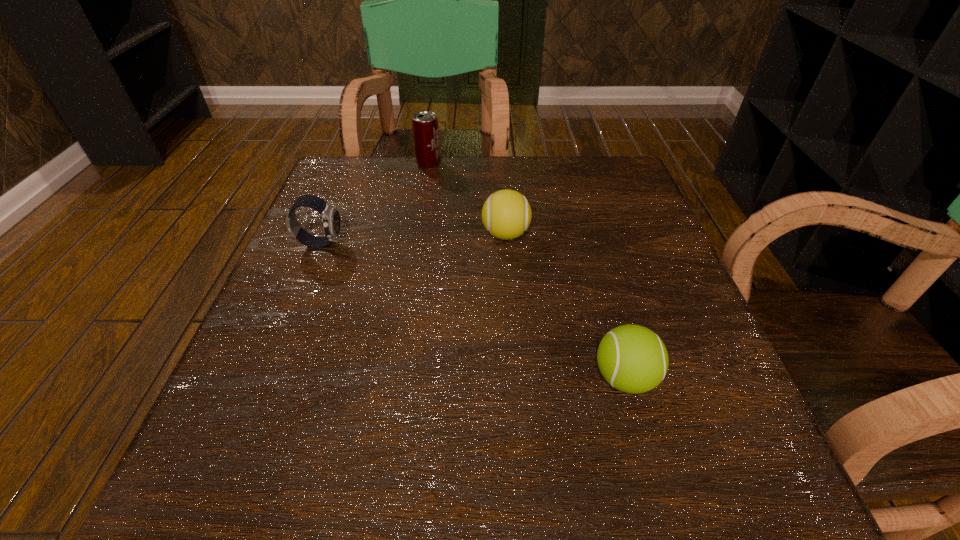
At what (x,y) coordinates should I click in order to perform the action: click on vacant space located 0.400m on the left of the right tennis ball. Please return your answer as a coordinate pair (x, y). This screenshot has height=540, width=960. Looking at the image, I should click on (321, 378).

Find the location of `object present at the far edge`. object present at the far edge is located at coordinates (425, 127).

Find the location of a particular element. Image resolution: width=960 pixels, height=540 pixels. object that is at the left edge is located at coordinates (330, 215).

Find the location of `object positioned at the right edge`. object positioned at the right edge is located at coordinates (633, 359).

Where is `free space at the far edge of the desktop`? free space at the far edge of the desktop is located at coordinates (547, 211).

Find the location of a particular element. vacant space at the near edge is located at coordinates (475, 475).

The height and width of the screenshot is (540, 960). In the image, there is a desktop. In order to click on free region at the left edge in this screenshot , I will do `click(316, 285)`.

Identify the location of vacant space at the right edge of the desktop. (660, 256).

You are a GUI agent. You are given a task and a screenshot of the screen. Output one action in this format:
    pyautogui.click(x=<x>, y=<y>)
    Task: Click on the vacant position at the far left corner of the desktop
    The width and height of the screenshot is (960, 540).
    Given the screenshot: What is the action you would take?
    pyautogui.click(x=357, y=161)

Image resolution: width=960 pixels, height=540 pixels. In order to click on free space at the near left corner of the desktop in this screenshot , I will do `click(197, 448)`.